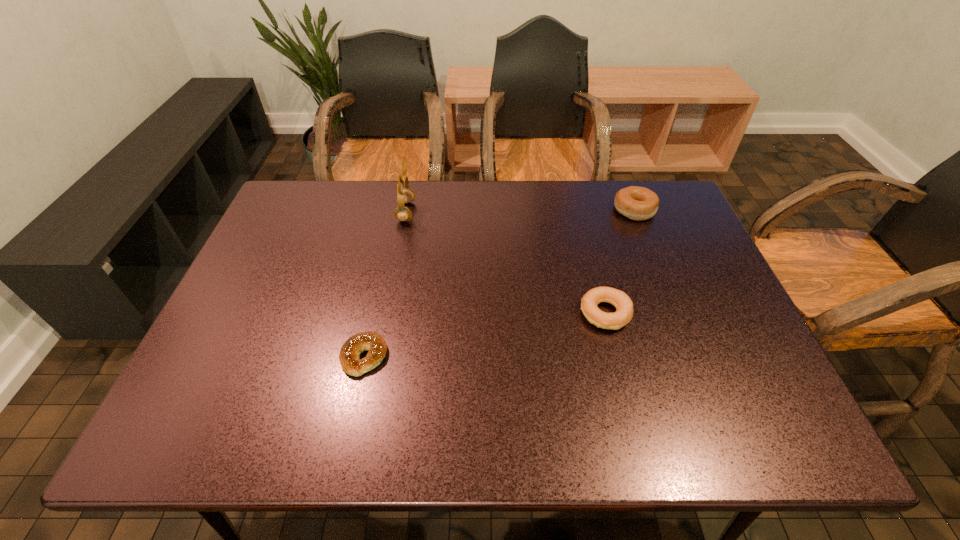
The width and height of the screenshot is (960, 540). Find the location of `the closest object to the rightmost bagel`. the closest object to the rightmost bagel is located at coordinates pos(621,301).

Locate an element on the screen. The width and height of the screenshot is (960, 540). object that is the third closest to the second tallest object is located at coordinates (374, 343).

Locate which bagel is the second closest to the tallest object. Please provide its 2D coordinates. Your answer should be formatted as a tuple, i.e. [(x, y)], where the tuple contains the x and y coordinates of a point satisfying the conditions above.

[(621, 301)]

What are the coordinates of `bagel object that ranks as the second closest to the rightmost bagel` in the screenshot? It's located at (374, 343).

Locate an element on the screen. The height and width of the screenshot is (540, 960). vacant area that satisfies the following two spatial constraints: 1. on the front-facing side of the tallest object; 2. on the front side of the nearest object is located at coordinates (378, 356).

I want to click on vacant region that satisfies the following two spatial constraints: 1. on the front-facing side of the earphone; 2. on the back side of the third tallest object, so click(x=387, y=313).

Image resolution: width=960 pixels, height=540 pixels. Find the location of `free space that satisfies the following two spatial constraints: 1. on the front-facing side of the earphone; 2. on the back side of the second bagel from left to right`. free space that satisfies the following two spatial constraints: 1. on the front-facing side of the earphone; 2. on the back side of the second bagel from left to right is located at coordinates (387, 313).

The width and height of the screenshot is (960, 540). What are the coordinates of `free point that satisfies the following two spatial constraints: 1. on the front-facing side of the tallest object; 2. on the left side of the second shortest object` in the screenshot? It's located at (387, 313).